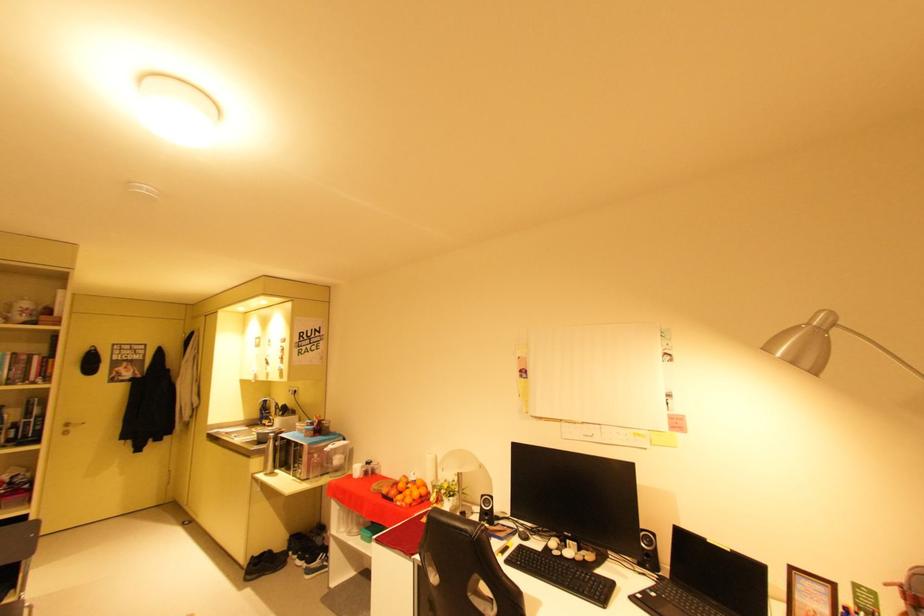
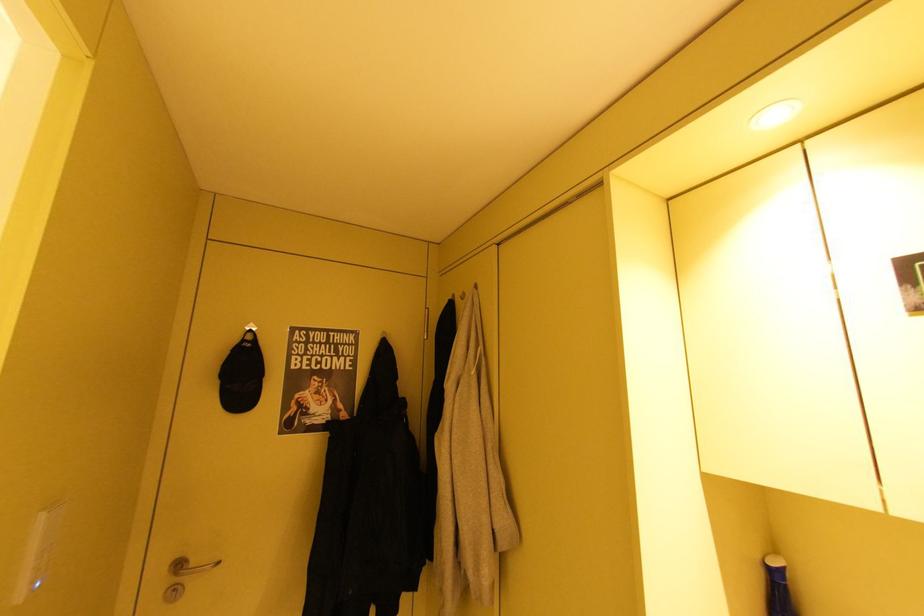
The images are taken continuously from a first-person perspective. In which direction are you moving?

The movement direction of the cameraman is left, forward.